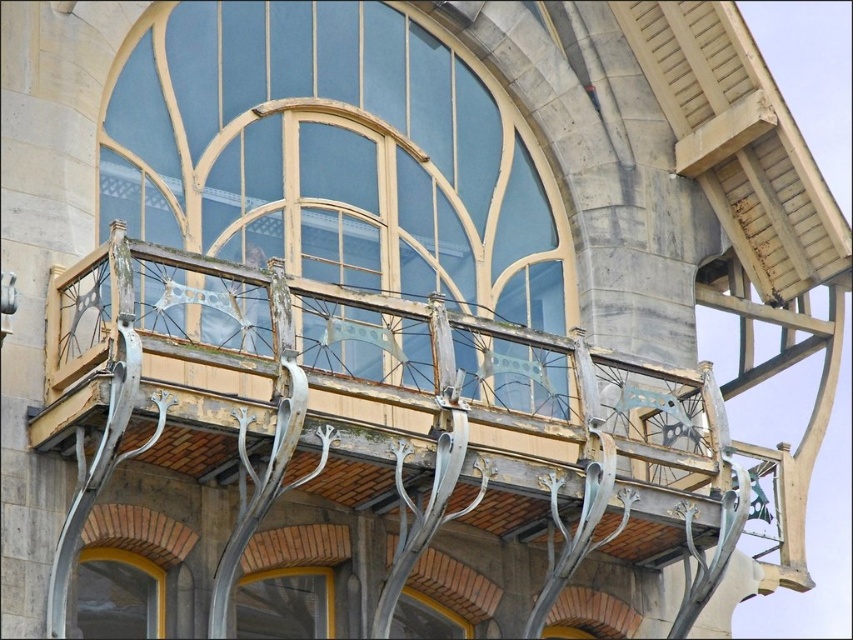
Is the position of metallic silver balcony at center more distant than that of matte glass window at lower center?

No.

Does metallic silver balcony at center lie in front of matte glass window at lower center?

Yes, metallic silver balcony at center is closer to the viewer.

Who is more forward, (703, 540) or (305, 598)?

Point (305, 598)

Where is `metallic silver balcony at center`? The width and height of the screenshot is (853, 640). metallic silver balcony at center is located at coordinates (373, 449).

Which is more to the left, matte glass window at center or matte glass window at lower left?

matte glass window at lower left

Can you confirm if matte glass window at center is positioned to the right of matte glass window at lower left?

Yes, matte glass window at center is to the right of matte glass window at lower left.

You are a GUI agent. You are given a task and a screenshot of the screen. Output one action in this format:
    pyautogui.click(x=<x>, y=<y>)
    Task: Click on the matte glass window at center
    Image resolution: width=853 pixels, height=640 pixels.
    Given the screenshot: What is the action you would take?
    pyautogui.click(x=334, y=156)

Between matte glass window at center and matte glass window at lower center, which one is positioned higher?

Positioned higher is matte glass window at center.

Is matte glass window at center further to camera compared to matte glass window at lower center?

No, it is not.

The width and height of the screenshot is (853, 640). Describe the element at coordinates (334, 156) in the screenshot. I see `matte glass window at center` at that location.

Locate an element on the screen. matte glass window at center is located at coordinates (334, 156).